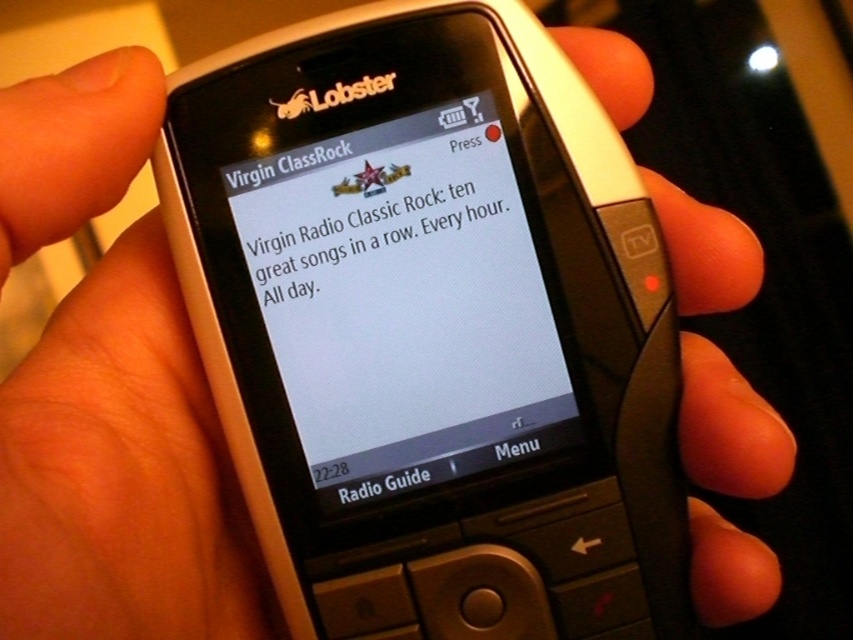
You are looking at the mobile phone screen and see two points marked on it. The first point is at coordinates point (x=383, y=205) and the second is at point (x=383, y=285). Which point is closer to you?

Point (x=383, y=205) is further to the viewer than point (x=383, y=285), so the first point is closer to you.